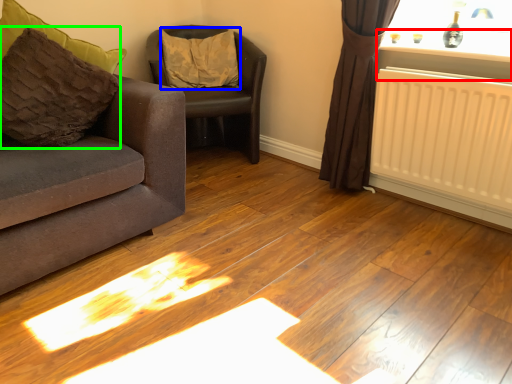
Question: Which object is positioned farthest from window sill (highlighted by a red box)? Select from pillow (highlighted by a blue box) and pillow (highlighted by a green box).

Choices:
 (A) pillow
 (B) pillow

Answer: (B)